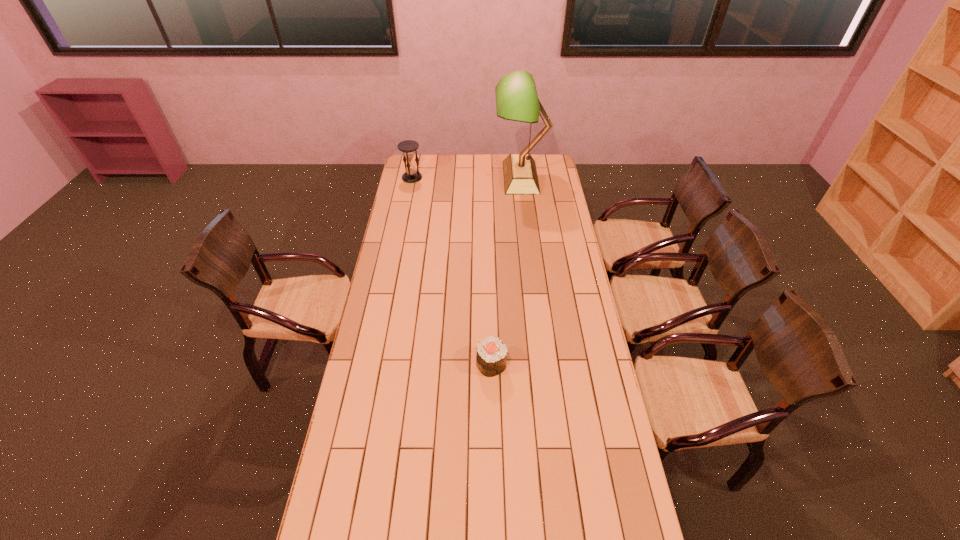
Locate an element on the screen. The image size is (960, 540). the tallest object is located at coordinates (516, 97).

Locate an element on the screen. The image size is (960, 540). the leftmost object is located at coordinates (409, 147).

Find the location of a particular element. hourglass is located at coordinates (409, 147).

Identify the location of the shortest object. This screenshot has height=540, width=960. (491, 357).

Identify the location of sushi. (491, 357).

At what (x,y) coordinates should I click in order to perform the action: click on vacant space located on the metallic stand of the table lamp. Please return your answer as a coordinate pair (x, y). Looking at the image, I should click on pyautogui.click(x=448, y=177).

The width and height of the screenshot is (960, 540). I want to click on free region located on the metallic stand of the table lamp, so click(430, 177).

Where is `free region located 0.290m on the metallic stand of the table lamp`? This screenshot has width=960, height=540. free region located 0.290m on the metallic stand of the table lamp is located at coordinates pyautogui.click(x=445, y=177).

This screenshot has height=540, width=960. In order to click on free space located 0.150m on the front of the leftmost object in this screenshot , I will do `click(408, 198)`.

Where is `free space located on the back of the nearest object`? free space located on the back of the nearest object is located at coordinates (491, 320).